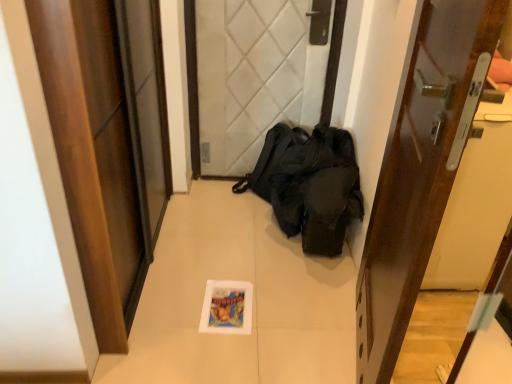
Question: Based on their positions, is wooden glossy door at right, arranged as the third door when viewed from the left, located to the left or right of white quilted fabric at center, the second door positioned from the right?

Choices:
 (A) left
 (B) right

Answer: (B)

Question: Considering the positions of wooden glossy door at right, the 1th door positioned from the right, and white quilted fabric at center, the second door positioned from the right, in the image, is wooden glossy door at right, the 1th door positioned from the right, taller or shorter than white quilted fabric at center, the second door positioned from the right,?

Choices:
 (A) short
 (B) tall

Answer: (B)

Question: Estimate the real-world distances between objects in this image. Which object is closer to the wooden glossy door at right, the 1th door positioned from the right?

Choices:
 (A) white quilted fabric at center, the second door positioned from the right
 (B) wooden door at left, placed as the first door when sorted from left to right

Answer: (B)

Question: Estimate the real-world distances between objects in this image. Which object is closer to the wooden door at left, placed as the first door when sorted from left to right?

Choices:
 (A) white quilted fabric at center, which is the second door in left-to-right order
 (B) wooden glossy door at right, arranged as the third door when viewed from the left

Answer: (B)